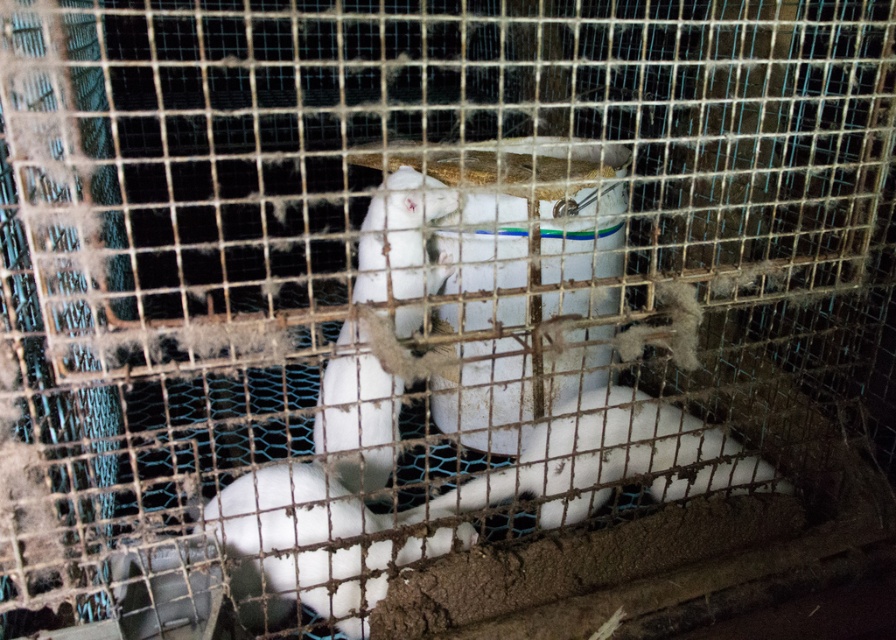
Image resolution: width=896 pixels, height=640 pixels. What are the coordinates of `white fluffy rabbit at center` in the screenshot? It's located at (319, 540).

Is point (268, 500) in front of point (365, 385)?

Yes.

I want to click on white fluffy rabbit at center, so click(x=319, y=540).

Does point (576, 412) lie in front of point (337, 506)?

Yes, it is.

Can you confirm if white fur rabbit at center is wider than white fluffy rabbit at center?

Yes.

Find the location of a particular element. This screenshot has height=640, width=896. white fur rabbit at center is located at coordinates (614, 458).

Does white fur rabbit at center have a greater height compared to white fur animal at center?

No.

Is white fur rabbit at center bigger than white fur animal at center?

Actually, white fur rabbit at center might be smaller than white fur animal at center.

The image size is (896, 640). In order to click on white fur rabbit at center in this screenshot , I will do `click(614, 458)`.

Find the location of a particular element. Image resolution: width=896 pixels, height=640 pixels. white fur rabbit at center is located at coordinates (614, 458).